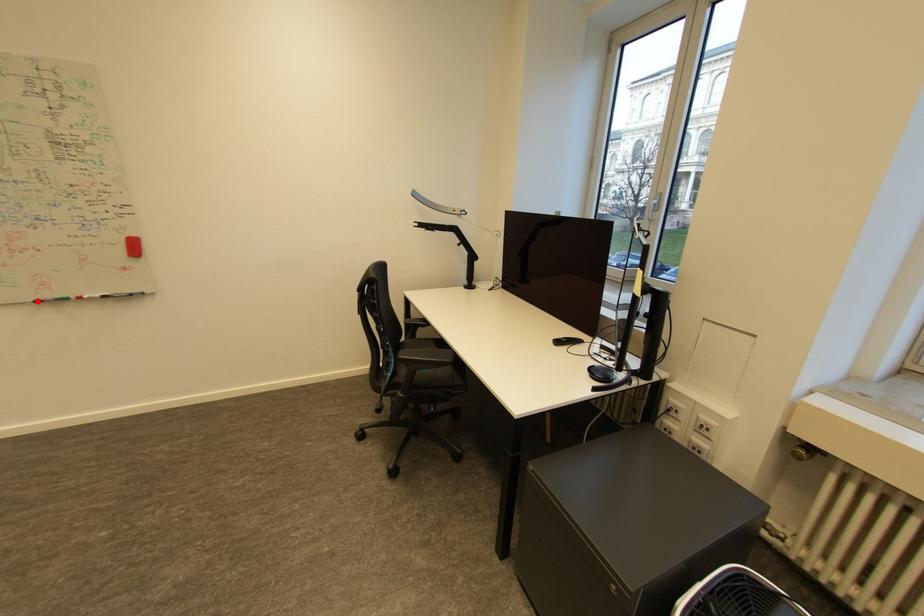
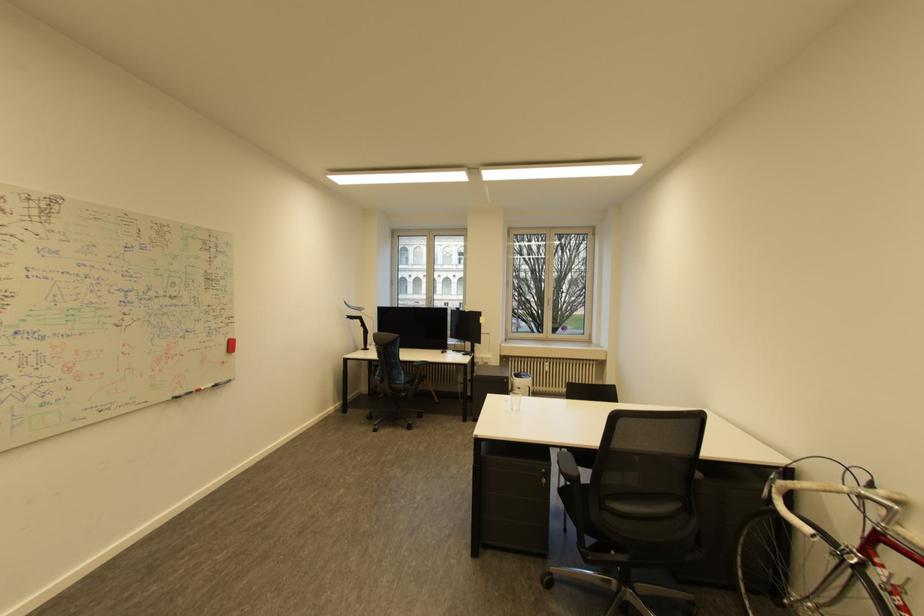
Question: I am providing you with two images of the same scene from different viewpoints. A red point is marked on the first image. Can you still see the location of the red point in image 2?

Choices:
 (A) Yes
 (B) No

Answer: (A)